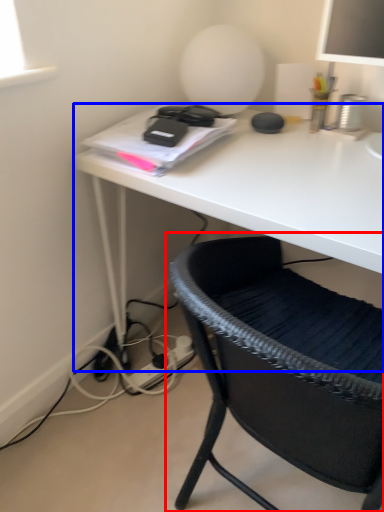
Question: Which object is closer to the camera taking this photo, chair (highlighted by a red box) or desk (highlighted by a blue box)?

Choices:
 (A) chair
 (B) desk

Answer: (A)